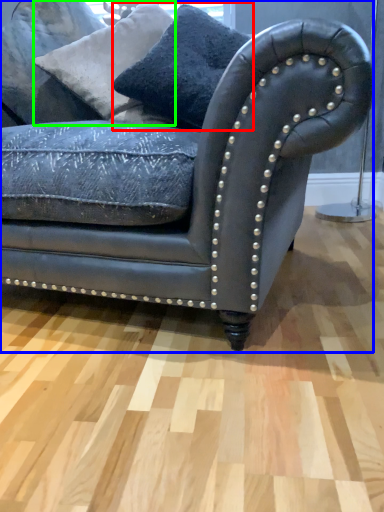
Question: Considering the real-world distances, which object is closest to pillow (highlighted by a red box)? studio couch (highlighted by a blue box) or pillow (highlighted by a green box).

Choices:
 (A) studio couch
 (B) pillow

Answer: (B)